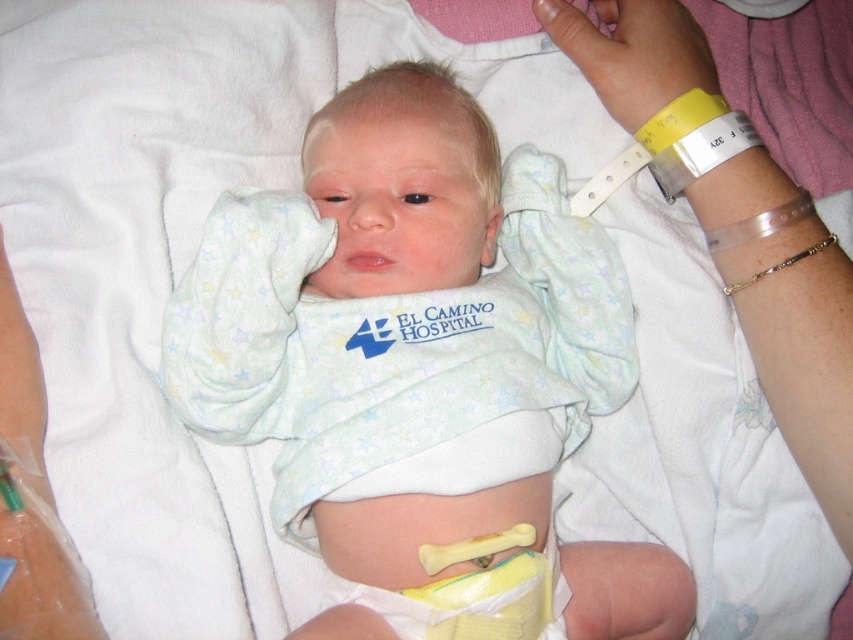
How much distance is there between light blue cotton onesie at center and yellow plastic wristband at upper right?

They are 12.37 inches apart.

Who is shorter, light blue cotton onesie at center or yellow plastic wristband at upper right?

yellow plastic wristband at upper right is shorter.

The image size is (853, 640). I want to click on light blue cotton onesie at center, so click(422, 371).

Locate an element on the screen. light blue cotton onesie at center is located at coordinates (422, 371).